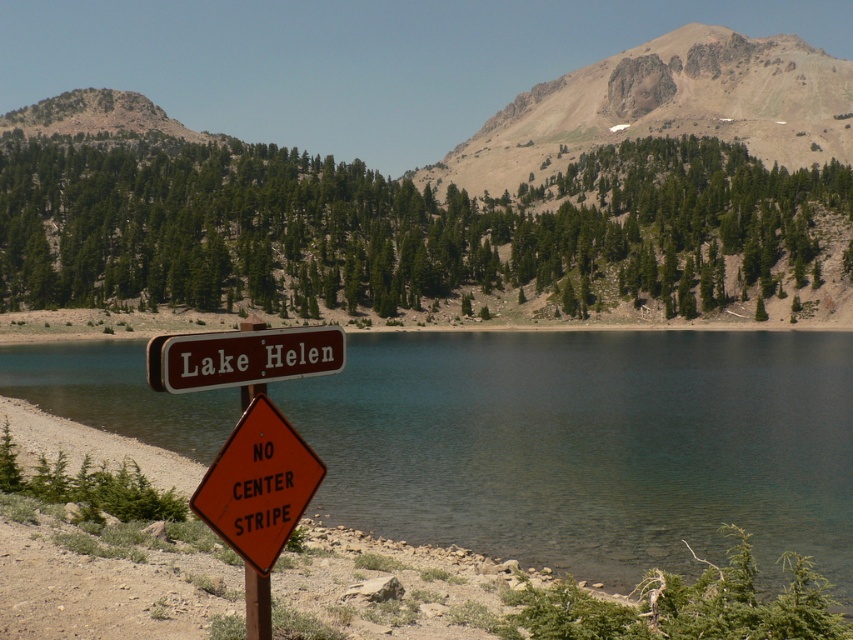
Between point (596, 115) and point (554, 525), which one is positioned behind?

The point (596, 115) is more distant.

Is brown rocky mountain at upper center shorter than clear water at lake center?

Incorrect, brown rocky mountain at upper center's height does not fall short of clear water at lake center's.

Which is in front, point (488, 140) or point (740, 465)?

Point (740, 465) is in front.

Where is `brown rocky mountain at upper center`? This screenshot has height=640, width=853. brown rocky mountain at upper center is located at coordinates (457, 196).

Who is higher up, orange diamond-shaped sign at lower center or brown wooden sign at center?

Positioned higher is brown wooden sign at center.

Does point (206, 513) come farther from viewer compared to point (218, 337)?

No, it is in front of (218, 337).

At what (x,y) coordinates should I click in order to perform the action: click on orange diamond-shaped sign at lower center. Please return your answer as a coordinate pair (x, y). The height and width of the screenshot is (640, 853). Looking at the image, I should click on (258, 484).

Between orange diamond-shaped sign at lower center and metallic pole at center, which one has less height?

orange diamond-shaped sign at lower center

Is point (212, 524) more distant than point (258, 620)?

No, (212, 524) is in front of (258, 620).

Locate an element on the screen. orange diamond-shaped sign at lower center is located at coordinates (258, 484).